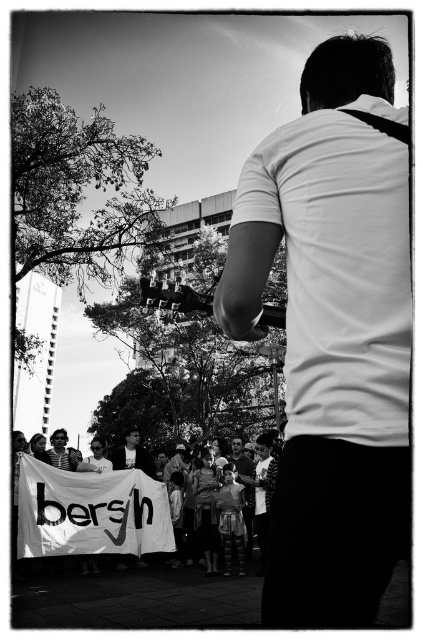
You are a photographer trying to capture the scene. You notice the white smooth shirt at center and the white paper banner at lower left. Which object should you focus on first if you want to photograph the taller one?

The white smooth shirt at center is taller than the white paper banner at lower left, so you should focus on the white smooth shirt at center first.

You are a photographer trying to capture the person in the white smooth shirt at center. If your camera has a focus point at coordinate 0.522, 0.787, will it align with the subject?

Yes, the white smooth shirt at center is positioned exactly at point (332, 333), so the camera focus point will align with the subject.